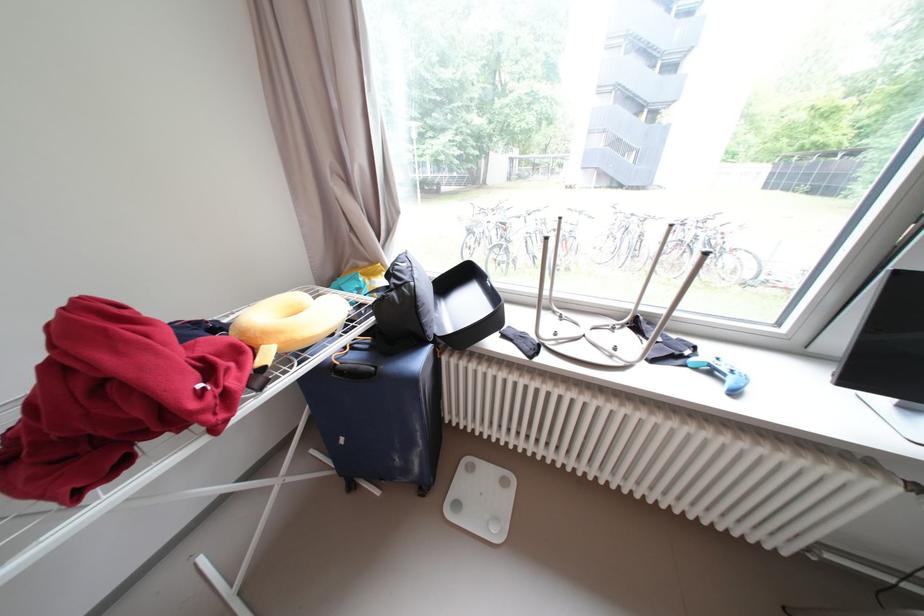
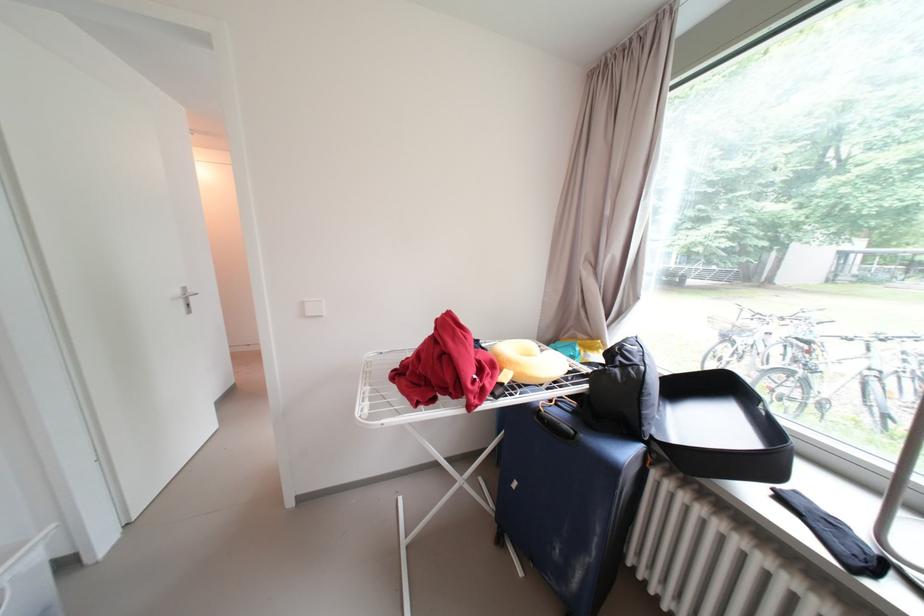
Locate, in the second image, the point that corresponds to point (414, 288) in the first image.

(640, 371)